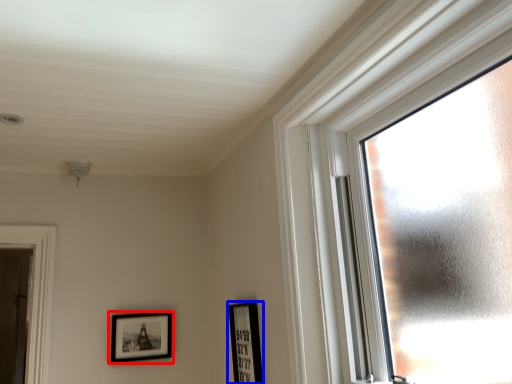
Question: Among these objects, which one is farthest to the camera, picture frame (highlighted by a red box) or picture frame (highlighted by a blue box)?

Choices:
 (A) picture frame
 (B) picture frame

Answer: (A)